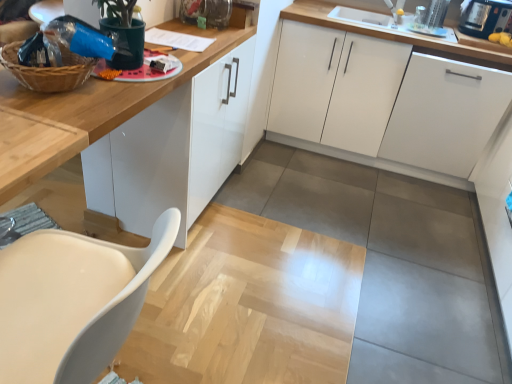
Locate an element on the screen. The width and height of the screenshot is (512, 384). empty space that is to the right of white glossy cabinet at upper center, the first cabinetry when ordered from left to right is located at coordinates (278, 214).